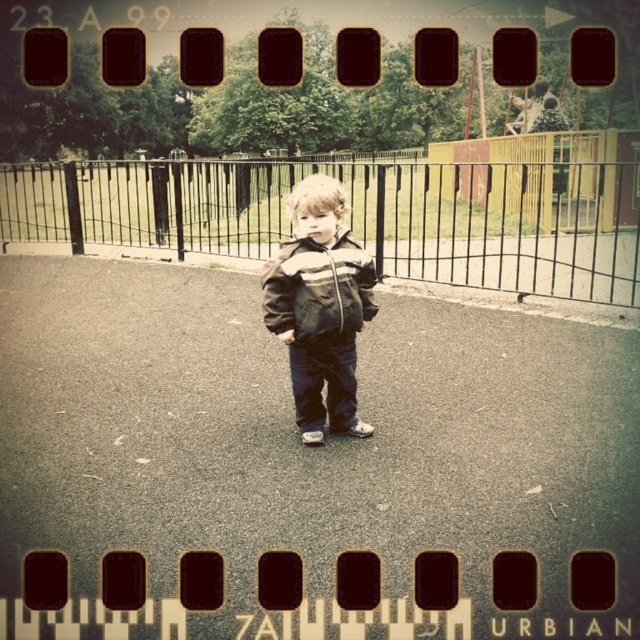
Question: Considering the real-world distances, which object is closest to the striped fabric jacket at center?

Choices:
 (A) black metal fence at center
 (B) brown textured jacket at center

Answer: (B)

Question: Is black metal fence at center bigger than brown textured jacket at center?

Choices:
 (A) no
 (B) yes

Answer: (B)

Question: Estimate the real-world distances between objects in this image. Which object is closer to the striped fabric jacket at center?

Choices:
 (A) black metal fence at center
 (B) brown textured jacket at center

Answer: (B)

Question: Does brown textured jacket at center have a lesser width compared to striped fabric jacket at center?

Choices:
 (A) no
 (B) yes

Answer: (A)

Question: Which of the following is the closest to the observer?

Choices:
 (A) (275, 284)
 (B) (342, 204)

Answer: (A)

Question: Is black metal fence at center smaller than brown textured jacket at center?

Choices:
 (A) no
 (B) yes

Answer: (A)